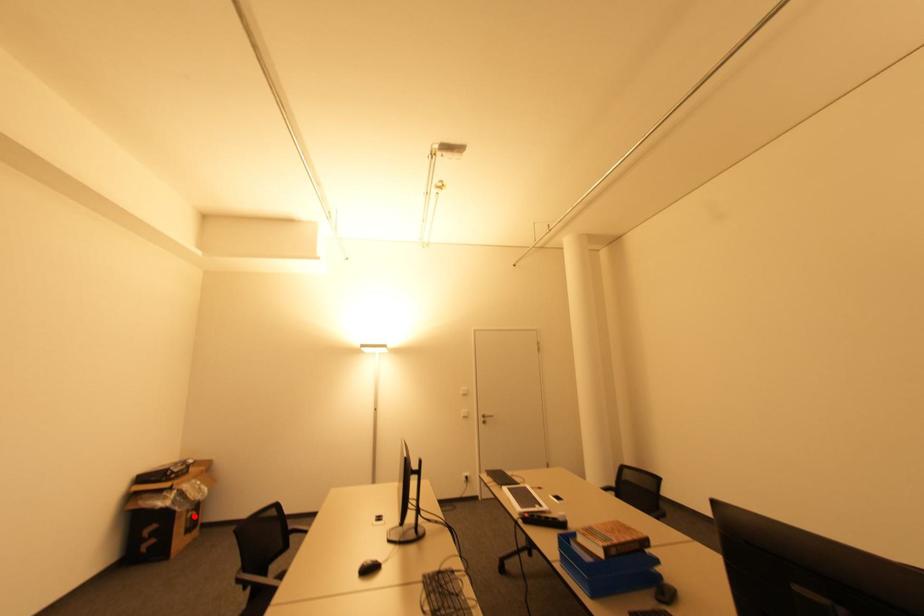
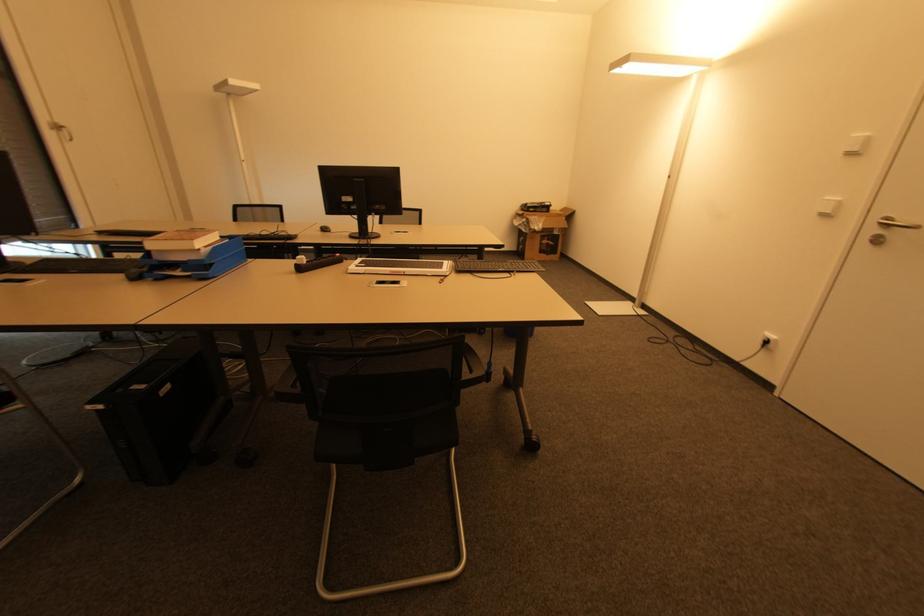
Question: I am providing you with two images of the same scene from different viewpoints. In image1, a red point is highlighted. Considering the same 3D point in image2, which of the following is correct?

Choices:
 (A) It is closer
 (B) It is farther

Answer: (A)